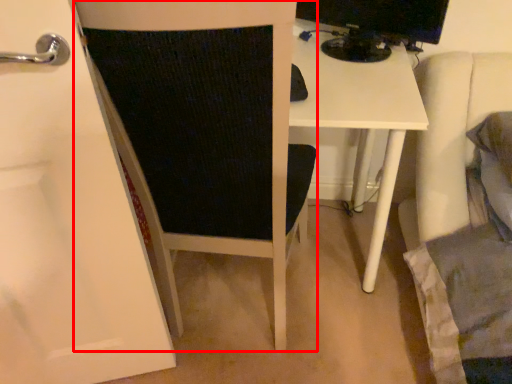
Question: From the image's perspective, what is the correct spatial positioning of furniture (annotated by the red box) in reference to desktop computer?

Choices:
 (A) above
 (B) below

Answer: (B)